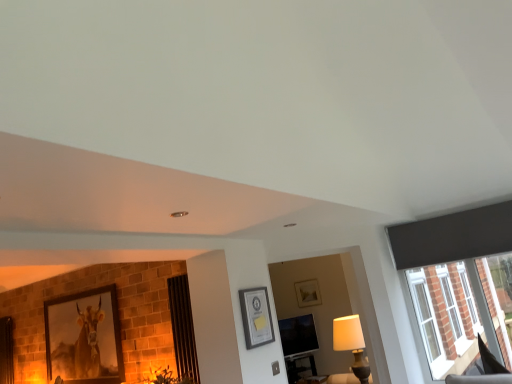
Question: Is matte black screen at center to the left or to the right of matte black picture frame at center, which is the first picture frame from right to left, in the image?

Choices:
 (A) right
 (B) left

Answer: (A)

Question: From the image's perspective, is matte black screen at center positioned above or below matte black picture frame at center, which is the second picture frame in bottom-to-top order?

Choices:
 (A) above
 (B) below

Answer: (B)

Question: Estimate the real-world distances between objects in this image. Which object is farther from the white fabric lampshade at lower right?

Choices:
 (A) matte black picture frame at center, placed as the second picture frame when sorted from left to right
 (B) matte black screen at center
 (C) matte wooden picture frame at left, which ranks as the first picture frame in back-to-front order
 (D) black leather swivel chair at lower right

Answer: (C)

Question: Which of these objects is positioned farthest from the matte black screen at center?

Choices:
 (A) white fabric lampshade at lower right
 (B) black leather swivel chair at lower right
 (C) matte black picture frame at center, placed as the second picture frame when sorted from left to right
 (D) matte wooden picture frame at left, which appears as the second picture frame when viewed from the top

Answer: (C)